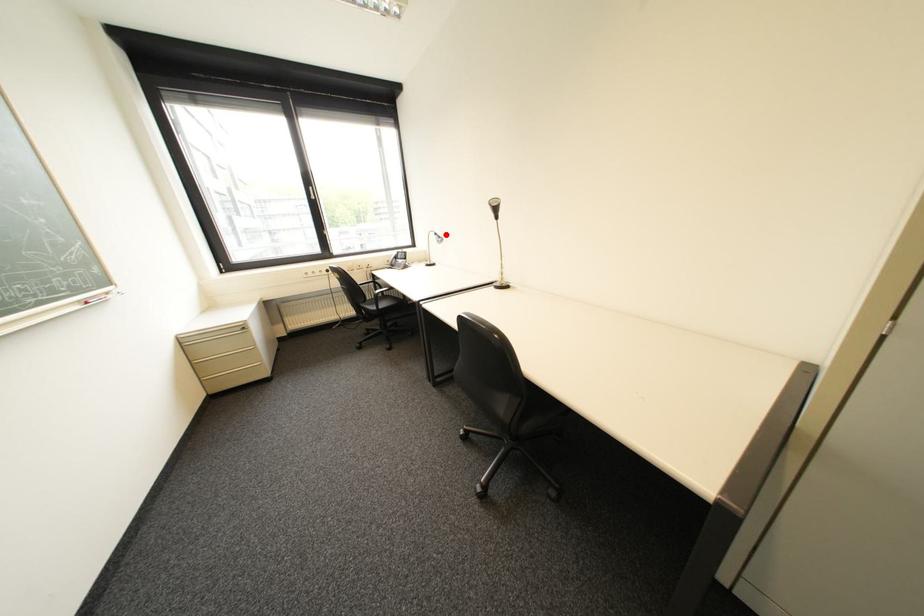
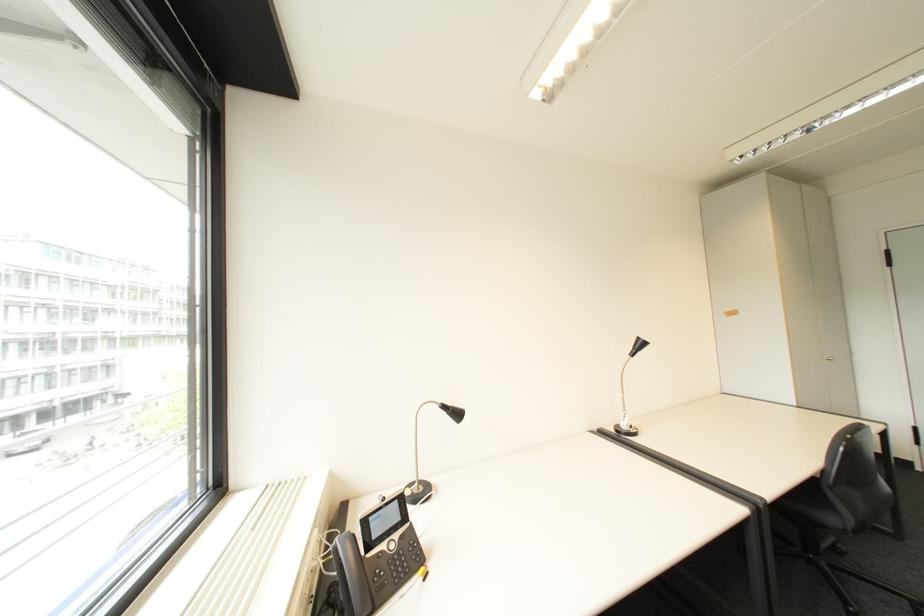
Question: I am providing you with two images of the same scene from different viewpoints. A red point is marked on the first image. At the location where the point appears in image 1, is it still visible in image 2?

Choices:
 (A) Yes
 (B) No

Answer: (A)